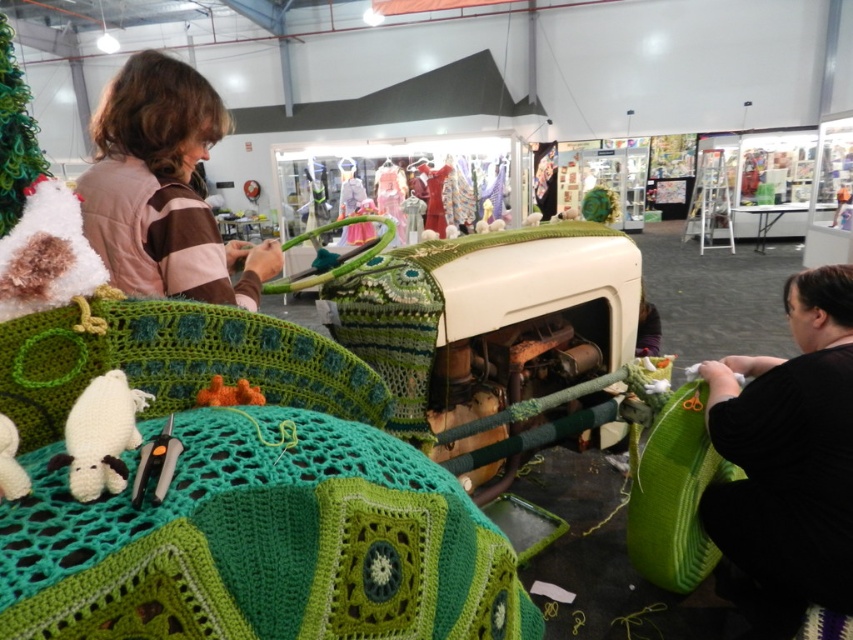
You are organizing a craft fair and need to display the green crocheted blanket at lower left and the pink striped sweater at upper left on a shelf. Which item should you place first on the shelf to ensure both fit without overlapping?

You should place the pink striped sweater at upper left first because the green crocheted blanket at lower left is smaller and can fit next to it without overlapping.

You are standing in the workshop and see two points marked in the image. Which point, point (0, 422) or point (248, 403), is closer to you?

Point (0, 422) is closer to you because it is in front of point (248, 403).